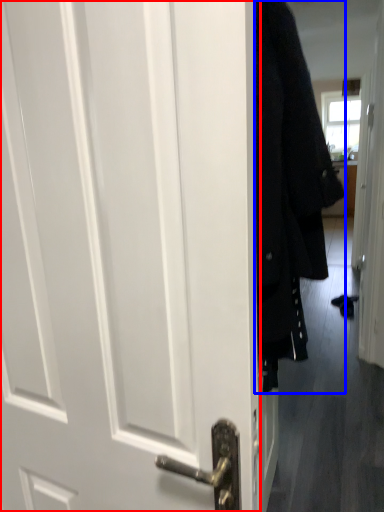
Question: Which object is closer to the camera taking this photo, door (highlighted by a red box) or coat (highlighted by a blue box)?

Choices:
 (A) door
 (B) coat

Answer: (A)